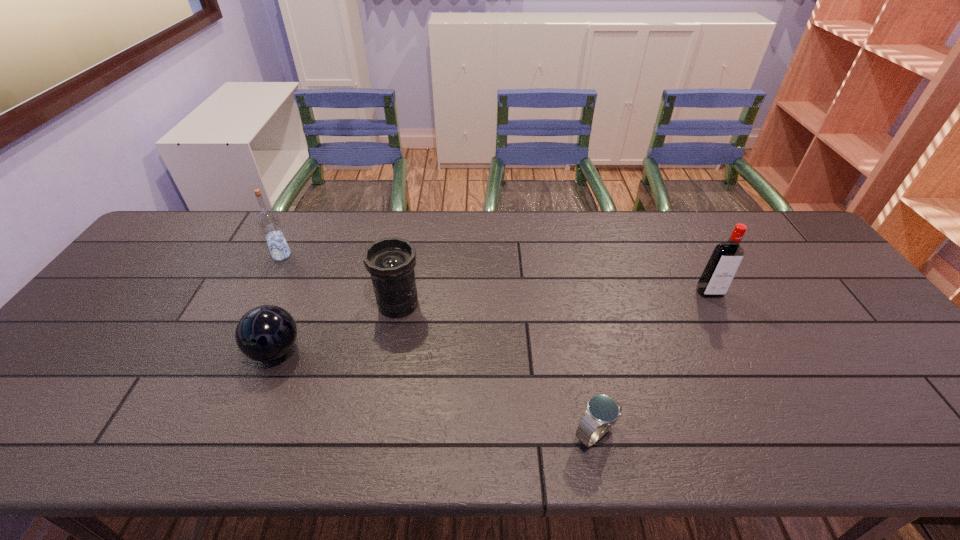
Image resolution: width=960 pixels, height=540 pixels. Identify the location of free space at the right edge of the desktop. (816, 295).

Find the location of a particular element. This screenshot has height=540, width=960. free space at the far left corner is located at coordinates (214, 219).

Locate an element on the screen. free region at the far right corner is located at coordinates (787, 230).

At what (x,y) coordinates should I click in order to perform the action: click on empty space between the leftmost object and the second object from left to right. Please return your answer as a coordinate pair (x, y). The image size is (960, 540). Looking at the image, I should click on (278, 303).

At what (x,y) coordinates should I click in order to perform the action: click on blank region between the fourth tallest object and the shortest object. Please return your answer as a coordinate pair (x, y). The width and height of the screenshot is (960, 540). Looking at the image, I should click on coord(435,392).

Where is `vacant region between the nearer vodka and the watch`? vacant region between the nearer vodka and the watch is located at coordinates (652, 363).

Find the location of `vacant area between the telephoto lens and the rightmost object`. vacant area between the telephoto lens and the rightmost object is located at coordinates (554, 299).

You are a GUI agent. You are given a task and a screenshot of the screen. Output one action in this format:
    pyautogui.click(x=<x>, y=<y>)
    Task: Click on the vacant point located between the shortest object and the second shortest object
    The height and width of the screenshot is (540, 960).
    Given the screenshot: What is the action you would take?
    pyautogui.click(x=435, y=392)

I want to click on free space that is in between the fourth object from right to left and the telephoto lens, so click(x=337, y=327).

Image resolution: width=960 pixels, height=540 pixels. Identify the location of blank region between the rightmost object and the fourth object from left to right. (652, 363).